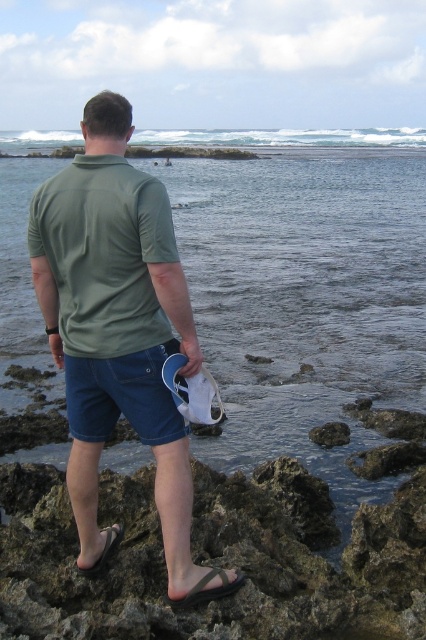
Consider the image. Between clear water at center and black rubber sandal at lower center, which one is positioned lower?

black rubber sandal at lower center is lower down.

Does clear water at center appear on the left side of black rubber sandal at lower center?

Correct, you'll find clear water at center to the left of black rubber sandal at lower center.

Does point (386, 252) lie in front of point (195, 605)?

No, it is behind (195, 605).

Locate an element on the screen. clear water at center is located at coordinates (305, 296).

Can you confirm if green matte shirt at center is positioned below black rubber sandal at lower center?

No, green matte shirt at center is not below black rubber sandal at lower center.

Who is more forward, (120, 360) or (189, 604)?

Point (189, 604) is more forward.

At what (x,y) coordinates should I click in order to perform the action: click on green matte shirt at center. Please return your answer as a coordinate pair (x, y). This screenshot has height=640, width=426. Looking at the image, I should click on (115, 323).

The image size is (426, 640). Find the location of `green matte shirt at center`. green matte shirt at center is located at coordinates (115, 323).

Which is in front, point (94, 300) or point (327, 445)?

Positioned in front is point (94, 300).

Which is behind, point (144, 193) or point (325, 435)?

Positioned behind is point (325, 435).

The height and width of the screenshot is (640, 426). Find the location of `green matte shirt at center`. green matte shirt at center is located at coordinates (115, 323).